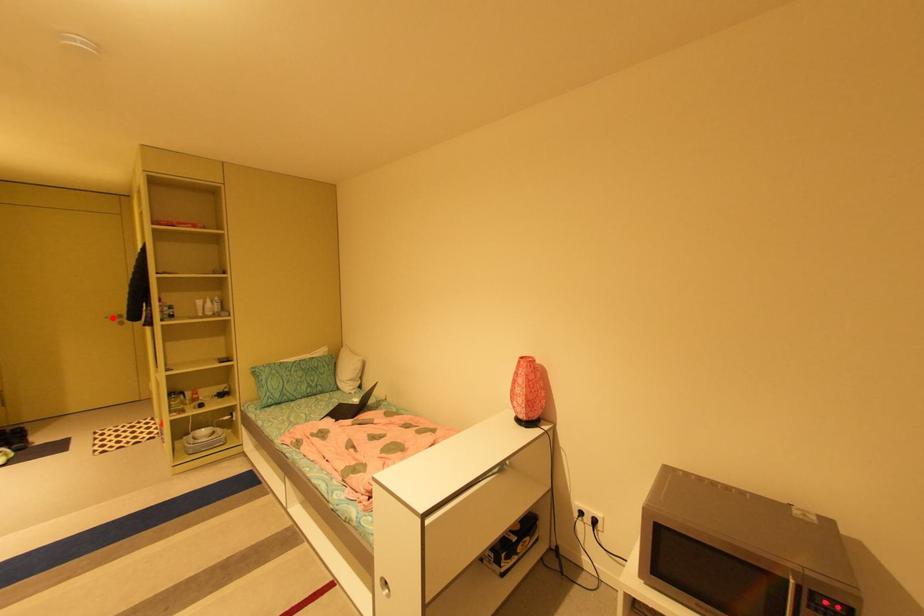
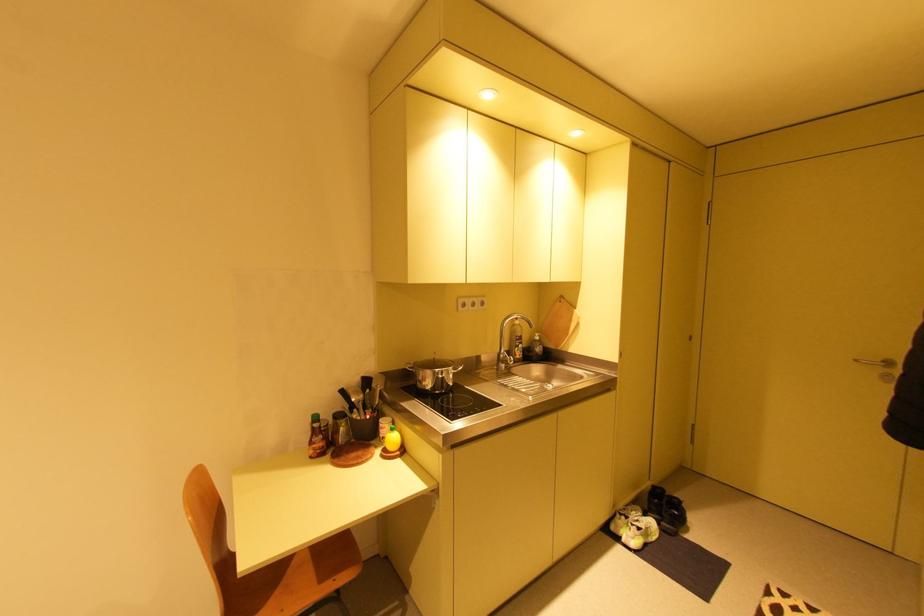
In the second image, find the point that corresponds to the highlighted location in the first image.

(861, 361)